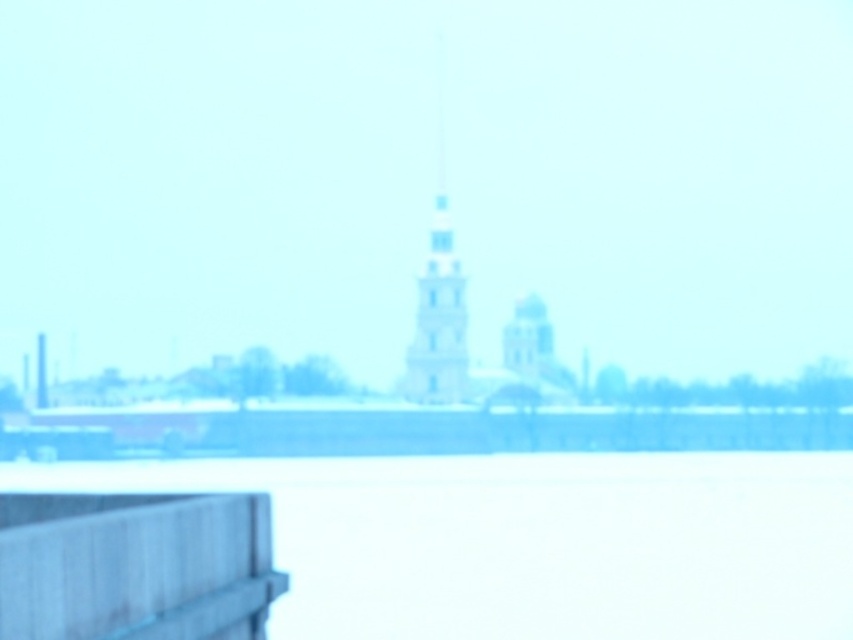
Between point (654, 608) and point (144, 609), which one is positioned behind?

The point (654, 608) is behind.

Is white matte water at lower center below gray wood rail at lower left?

Yes, white matte water at lower center is below gray wood rail at lower left.

Is point (718, 456) positioned after point (48, 524)?

Yes, point (718, 456) is farther from viewer.

In order to click on white matte water at lower center in this screenshot , I will do `click(534, 541)`.

Does point (442, 616) come farther from viewer compared to point (434, 198)?

No, it is in front of (434, 198).

Is white matte water at lower center bigger than white stone tower at center?

Indeed, white matte water at lower center has a larger size compared to white stone tower at center.

Where is `white matte water at lower center`? The height and width of the screenshot is (640, 853). white matte water at lower center is located at coordinates (534, 541).

Measure the distance from gray wood rail at lower left to white stone tower at center.

gray wood rail at lower left is 112.55 meters from white stone tower at center.

Can you confirm if gray wood rail at lower left is wider than white stone tower at center?

No, gray wood rail at lower left is not wider than white stone tower at center.

The height and width of the screenshot is (640, 853). Find the location of `gray wood rail at lower left`. gray wood rail at lower left is located at coordinates (134, 564).